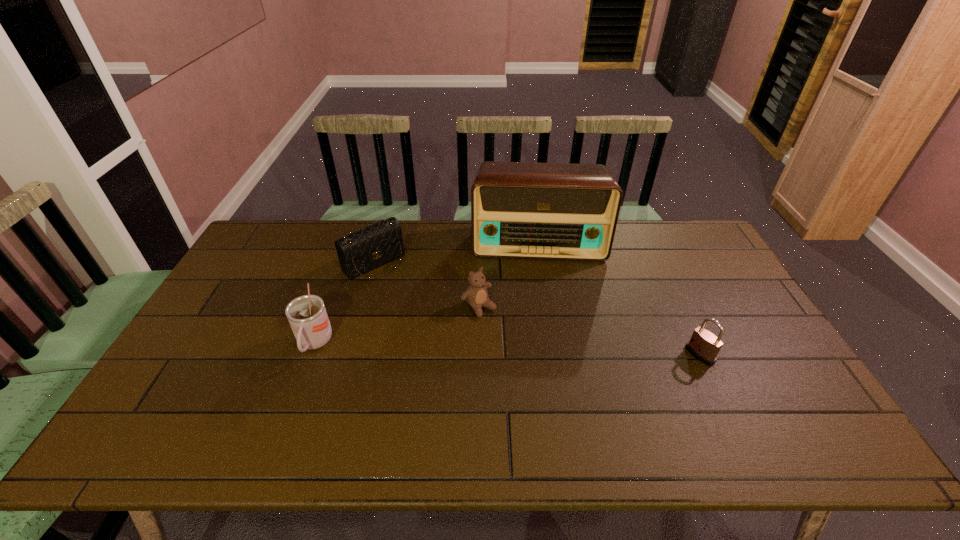
Locate an element on the screen. The width and height of the screenshot is (960, 540). free spot between the clutch bag and the teddy bear is located at coordinates (426, 285).

This screenshot has height=540, width=960. In order to click on vacant area that lies between the teddy bear and the tallest object in this screenshot , I will do click(508, 274).

Image resolution: width=960 pixels, height=540 pixels. What are the coordinates of `free space between the radio receiver and the padlock` in the screenshot? It's located at (618, 299).

Where is `free spot between the cup and the third farthest object`? The width and height of the screenshot is (960, 540). free spot between the cup and the third farthest object is located at coordinates (396, 325).

This screenshot has width=960, height=540. In order to click on object that can be found as the third closest to the clutch bag in this screenshot , I will do `click(552, 211)`.

Locate an element on the screen. The height and width of the screenshot is (540, 960). object that is the second closest to the clutch bag is located at coordinates (476, 294).

Find the location of a particular element. Image resolution: width=960 pixels, height=540 pixels. free region that satisfies the following two spatial constraints: 1. on the side with the handle of the rightmost object; 2. on the right side of the cup is located at coordinates (310, 355).

Locate an element on the screen. vacant area in the image that satisfies the following two spatial constraints: 1. on the front side of the teddy bear; 2. on the right side of the clutch bag is located at coordinates (362, 307).

This screenshot has height=540, width=960. Identify the location of free space that satisfies the following two spatial constraints: 1. on the back side of the tallest object; 2. on the left side of the clutch bag. (380, 242).